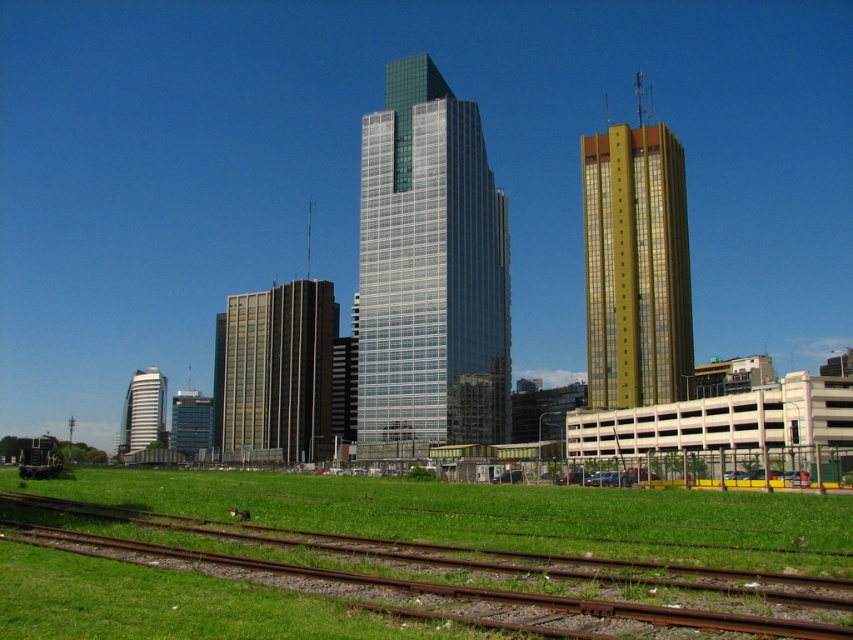
Based on the photo, between glassy silver skyscraper at center and gold/glassy building at right, which one is positioned higher?

gold/glassy building at right is above.

Is point (401, 65) closer to camera compared to point (624, 236)?

No, (401, 65) is further to viewer.

The width and height of the screenshot is (853, 640). What do you see at coordinates (430, 268) in the screenshot?
I see `glassy silver skyscraper at center` at bounding box center [430, 268].

What are the coordinates of `glassy silver skyscraper at center` in the screenshot? It's located at 430,268.

Is glassy silver skyscraper at center behind white glossy building at center?

No, glassy silver skyscraper at center is in front of white glossy building at center.

The image size is (853, 640). Find the location of `glassy silver skyscraper at center`. glassy silver skyscraper at center is located at coordinates (430, 268).

You are a GUI agent. You are given a task and a screenshot of the screen. Output one action in this format:
    pyautogui.click(x=<x>, y=<y>)
    Task: Click on the glassy silver skyscraper at center
    
    Given the screenshot: What is the action you would take?
    pyautogui.click(x=430, y=268)

Can you confirm if gold/glassy building at right is positioned to the left of brown glass building at center?

In fact, gold/glassy building at right is to the right of brown glass building at center.

Which is below, gold/glassy building at right or brown glass building at center?

brown glass building at center is below.

Describe the element at coordinates (636, 264) in the screenshot. The image size is (853, 640). I see `gold/glassy building at right` at that location.

At what (x,y) coordinates should I click in order to perform the action: click on gold/glassy building at right. Please return your answer as a coordinate pair (x, y). Image resolution: width=853 pixels, height=640 pixels. Looking at the image, I should click on (636, 264).